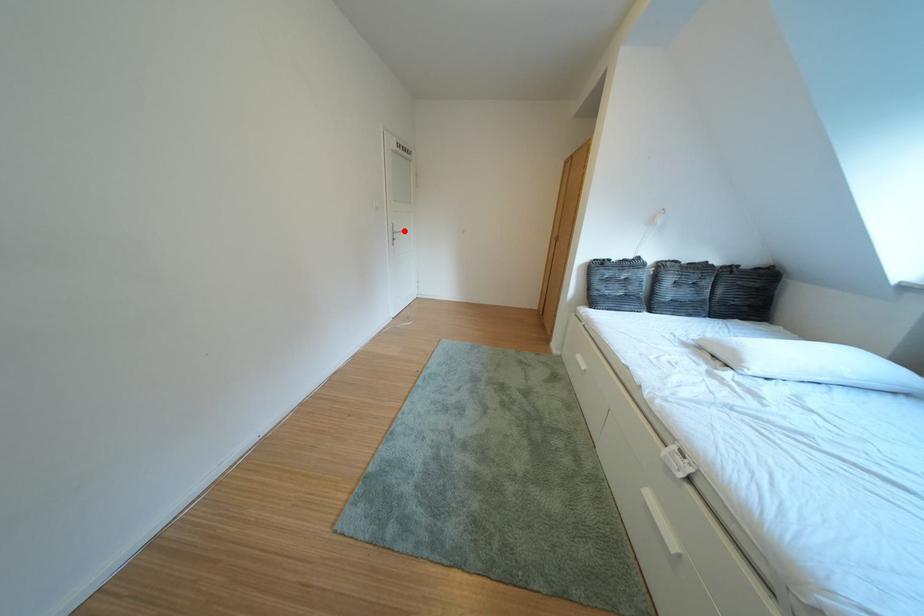
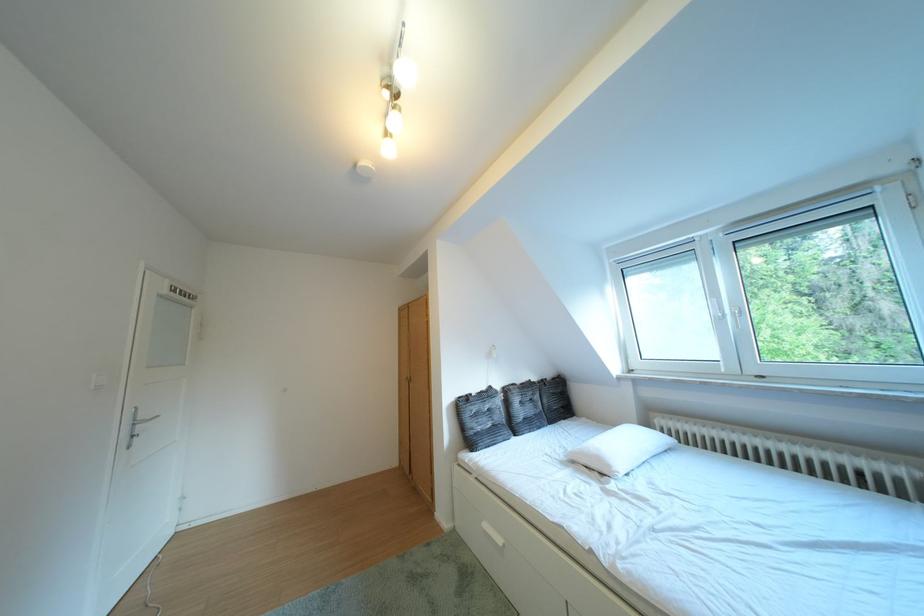
Question: I am providing you with two images of the same scene from different viewpoints. Given a red point in image1, look at the same physical point in image2. Is it:

Choices:
 (A) Closer to the viewpoint
 (B) Farther from the viewpoint

Answer: (B)